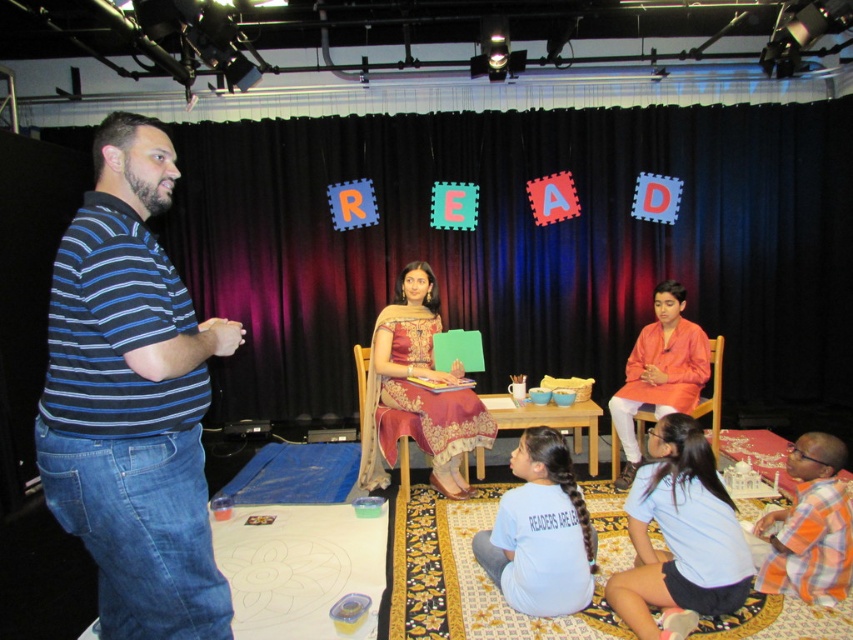
Which of these two, embroidered silk sari at center or light blue cotton shirt at lower center, stands shorter?

light blue cotton shirt at lower center is shorter.

Does point (395, 292) come closer to viewer compared to point (506, 513)?

No, (395, 292) is further to viewer.

You are a GUI agent. You are given a task and a screenshot of the screen. Output one action in this format:
    pyautogui.click(x=<x>, y=<y>)
    Task: Click on the embroidered silk sari at center
    
    Given the screenshot: What is the action you would take?
    pos(416,392)

Who is more distant from viewer, (111, 458) or (561, 563)?

The point (561, 563) is behind.

Does point (126, 259) lie behind point (488, 545)?

No, (126, 259) is closer to viewer.

Identify the location of blue striped polo shirt at left. This screenshot has height=640, width=853. (132, 400).

The height and width of the screenshot is (640, 853). Identify the location of blue striped polo shirt at left. (132, 400).

Is blue striped polo shirt at left to the left of light blue fabric at lower center from the viewer's perspective?

Correct, you'll find blue striped polo shirt at left to the left of light blue fabric at lower center.

Which is in front, point (61, 500) or point (677, 452)?

Point (61, 500)

I want to click on blue striped polo shirt at left, so click(132, 400).